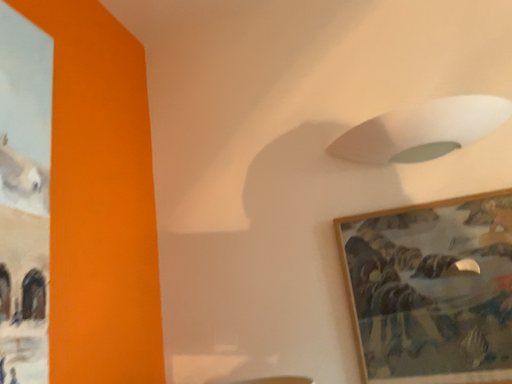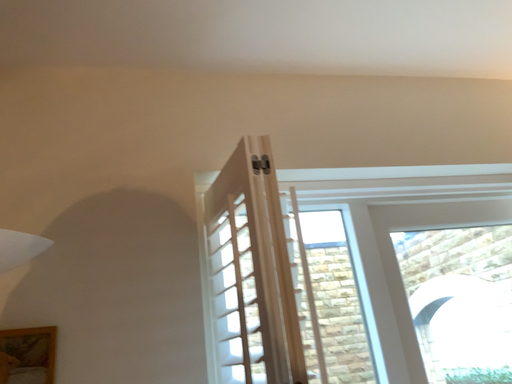
Question: How did the camera likely rotate when shooting the video?

Choices:
 (A) rotated left
 (B) rotated right

Answer: (B)